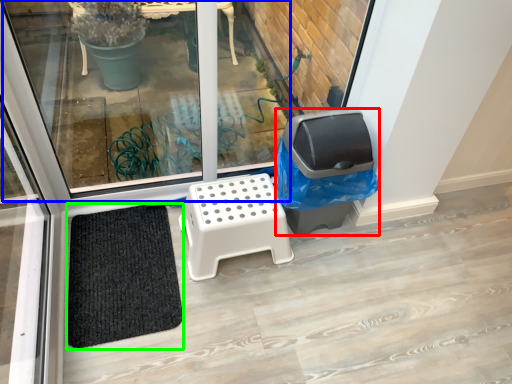
Question: Which is nearer to the garbage (highlighted by a red box)? window (highlighted by a blue box) or doormat (highlighted by a green box).

Choices:
 (A) window
 (B) doormat

Answer: (B)